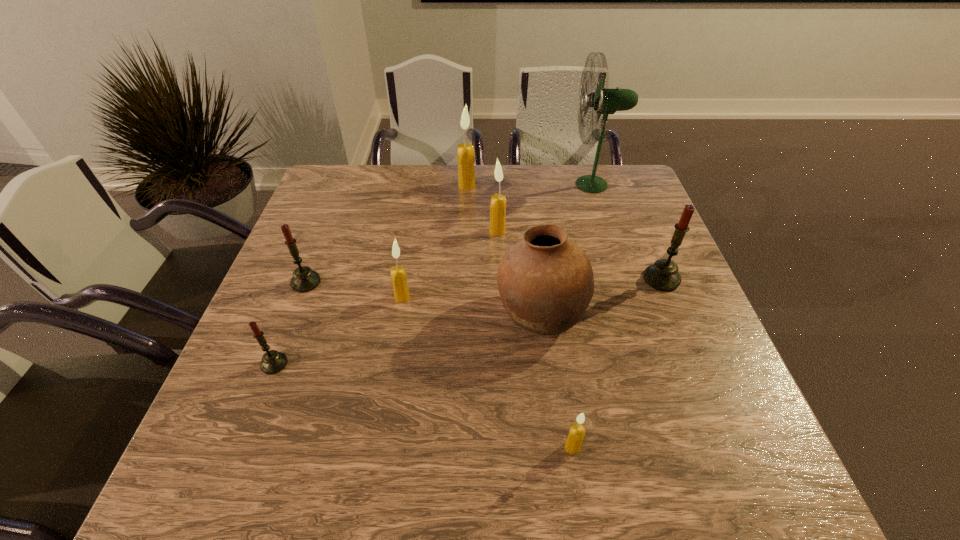
Find the location of a particular element. This screenshot has width=960, height=540. vacant space located 0.300m on the left of the rightmost candle is located at coordinates (523, 279).

You are a GUI agent. You are given a task and a screenshot of the screen. Output one action in this format:
    pyautogui.click(x=<x>, y=<y>)
    Task: Click on the free spot located 0.120m on the left of the third nearest cream candle
    The image size is (960, 540).
    Given the screenshot: What is the action you would take?
    pyautogui.click(x=446, y=231)

Where is `free space located on the back of the pottery`? The width and height of the screenshot is (960, 540). free space located on the back of the pottery is located at coordinates (525, 192).

The image size is (960, 540). Find the location of `free region located 0.340m on the back of the second smallest red candle`. free region located 0.340m on the back of the second smallest red candle is located at coordinates (340, 194).

Where is `vacant region located 0.240m on the left of the second smallest cream candle`? The width and height of the screenshot is (960, 540). vacant region located 0.240m on the left of the second smallest cream candle is located at coordinates (294, 297).

What are the coordinates of `vacant space located 0.280m on the back of the smallest red candle` in the screenshot? It's located at (314, 263).

Find the location of a particular element. This screenshot has height=540, width=960. free spot located 0.390m on the left of the nearest object is located at coordinates click(x=348, y=447).

Where is `fan that is at the far edge`? The image size is (960, 540). fan that is at the far edge is located at coordinates (605, 101).

Locate an element on the screen. The height and width of the screenshot is (540, 960). candle at the far edge is located at coordinates (465, 152).

Locate an element on the screen. The width and height of the screenshot is (960, 540). object present at the near edge is located at coordinates (573, 443).